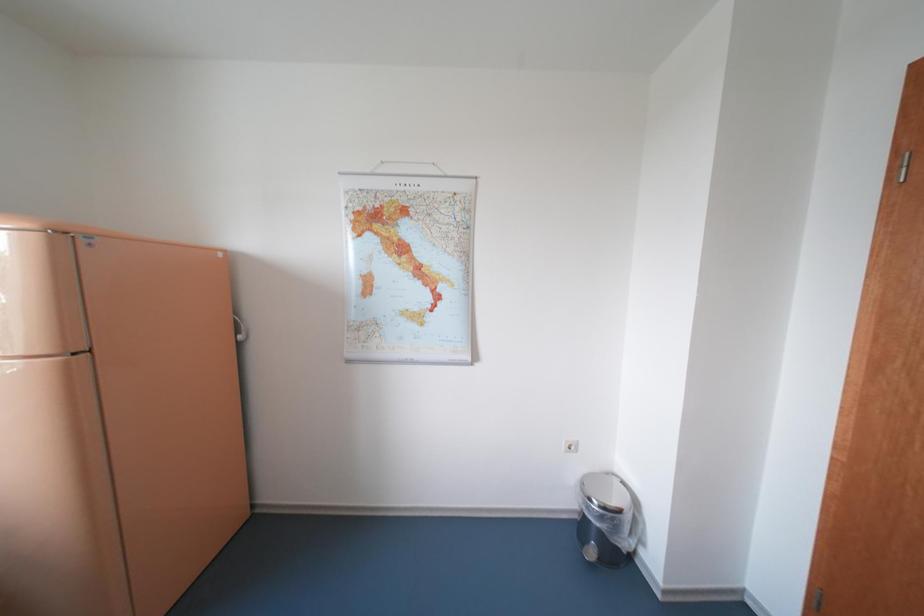
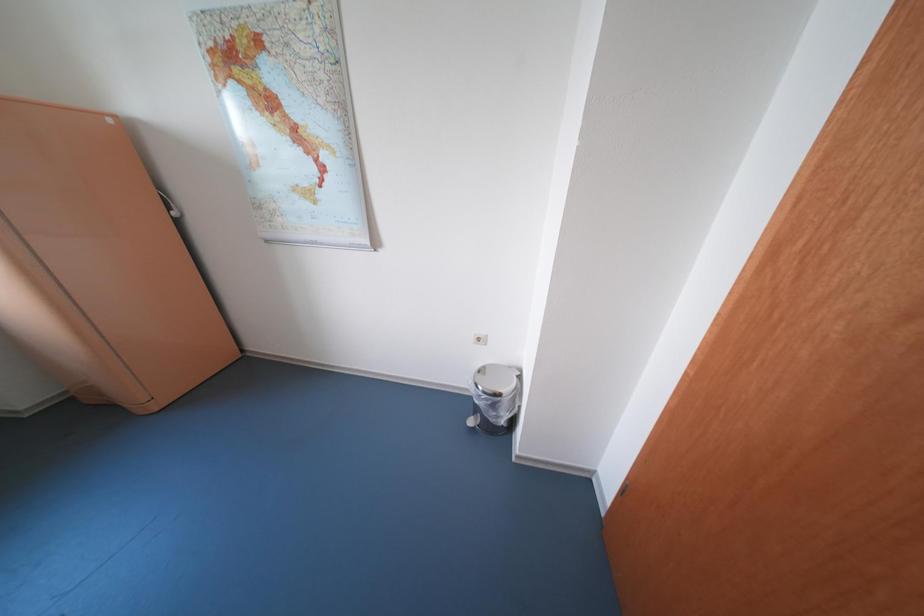
Question: The first image is from the beginning of the video and the second image is from the end. How did the camera likely rotate when shooting the video?

Choices:
 (A) Left
 (B) Right
 (C) Up
 (D) Down

Answer: (D)